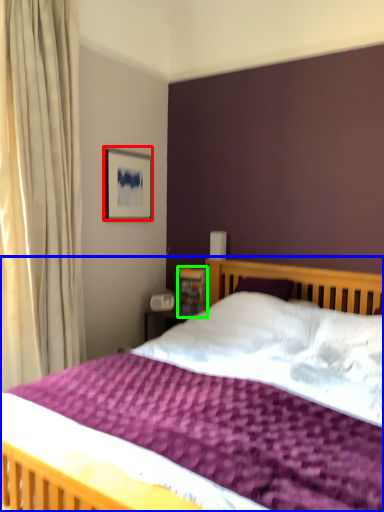
Question: Estimate the real-world distances between objects in this image. Which object is closer to picture frame (highlighted by a red box), bed (highlighted by a blue box) or bookshelf (highlighted by a green box)?

Choices:
 (A) bed
 (B) bookshelf

Answer: (B)